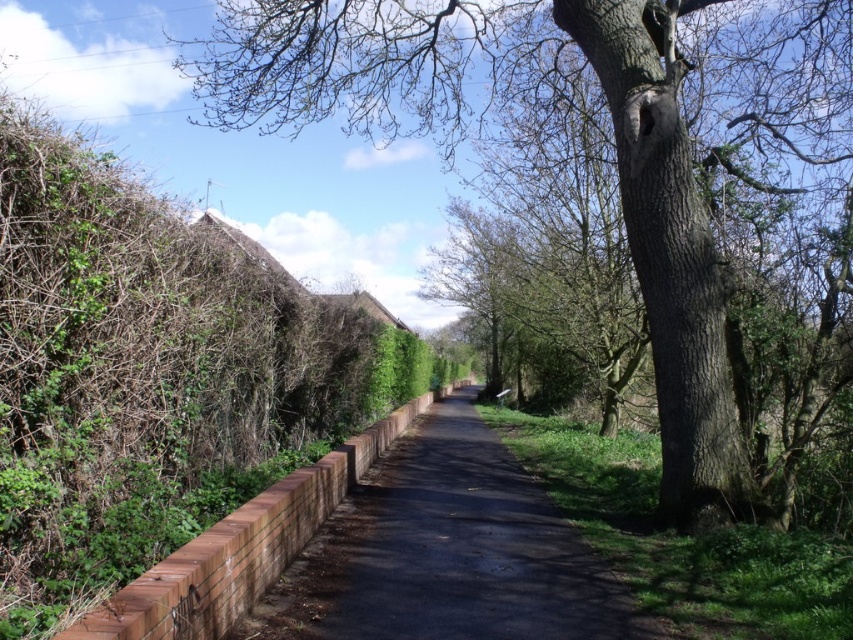
In order to click on brown rough bark tree at upper right in this screenshot , I will do `click(619, 177)`.

Is brown rough bark tree at upper right further to the viewer compared to brick wall at center?

Yes, it is behind brick wall at center.

Locate an element on the screen. The height and width of the screenshot is (640, 853). brown rough bark tree at upper right is located at coordinates (619, 177).

Find the location of a particular element. brown rough bark tree at upper right is located at coordinates tap(619, 177).

Between green leafy hedge at left and brick wall at center, which one has more height?

Standing taller between the two is green leafy hedge at left.

Consider the image. Does green leafy hedge at left appear over brick wall at center?

Yes, green leafy hedge at left is above brick wall at center.

Who is more forward, (x=1, y=410) or (x=447, y=616)?

Point (x=1, y=410)

Image resolution: width=853 pixels, height=640 pixels. Find the location of `green leafy hedge at left`. green leafy hedge at left is located at coordinates (151, 372).

Is brown rough bark tree at upper right smaller than green leafy hedge at left?

Incorrect, brown rough bark tree at upper right is not smaller in size than green leafy hedge at left.

What are the coordinates of `brown rough bark tree at upper right` in the screenshot? It's located at (619, 177).

This screenshot has width=853, height=640. Find the location of `brown rough bark tree at upper right`. brown rough bark tree at upper right is located at coordinates (619, 177).